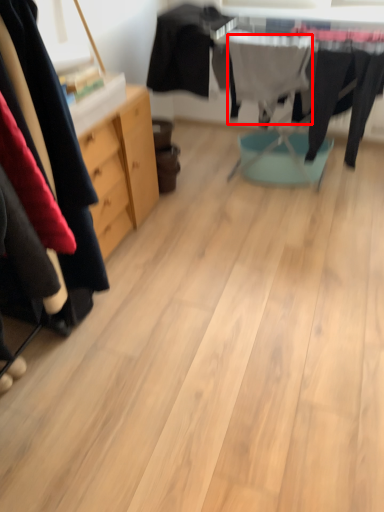
Question: In this image, where is clothing (annotated by the red box) located relative to clothing?

Choices:
 (A) left
 (B) right

Answer: (B)